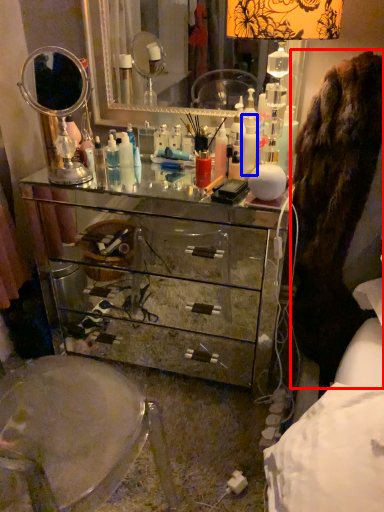
Question: Which object is further to the camera taking this photo, fur coat (highlighted by a red box) or toiletry (highlighted by a blue box)?

Choices:
 (A) fur coat
 (B) toiletry

Answer: (B)